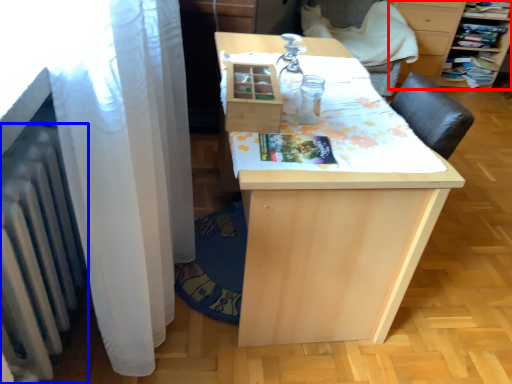
Question: Which point is closer to the camera, furniture (highlighted by a red box) or radiator (highlighted by a blue box)?

Choices:
 (A) furniture
 (B) radiator

Answer: (B)